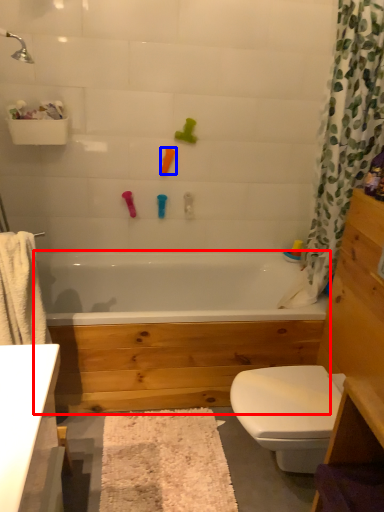
Question: Which point is further to the camera, bathtub (highlighted by a red box) or toy (highlighted by a blue box)?

Choices:
 (A) bathtub
 (B) toy

Answer: (B)